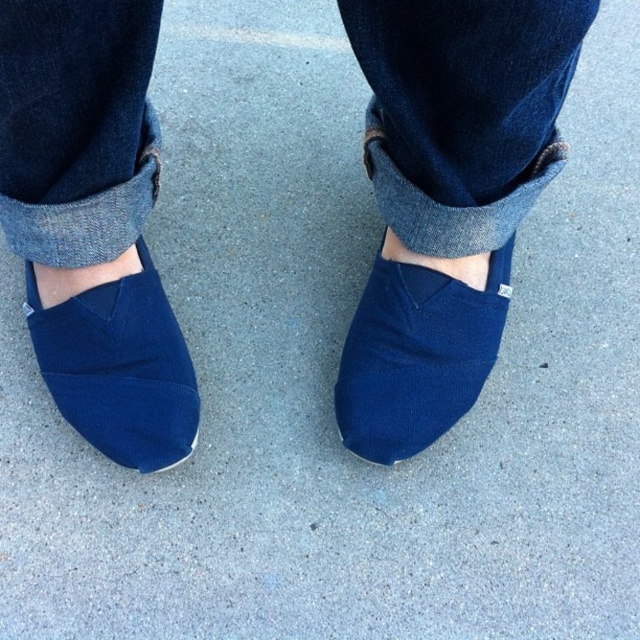
Which is above, navy blue canvas shoes at center or matte blue slip-on shoe at center?

navy blue canvas shoes at center is higher up.

Is navy blue canvas shoes at center wider than matte blue slip-on shoe at center?

Correct, the width of navy blue canvas shoes at center exceeds that of matte blue slip-on shoe at center.

This screenshot has height=640, width=640. What do you see at coordinates (445, 198) in the screenshot? I see `navy blue canvas shoes at center` at bounding box center [445, 198].

Where is `navy blue canvas shoes at center`? The image size is (640, 640). navy blue canvas shoes at center is located at coordinates (445, 198).

Can you confirm if navy blue canvas shoes at center is positioned below navy suede slip-on shoe at lower left?

No.

Find the location of a particular element. This screenshot has height=640, width=640. navy blue canvas shoes at center is located at coordinates (445, 198).

At what (x,y) coordinates should I click in order to perform the action: click on navy blue canvas shoes at center. Please return your answer as a coordinate pair (x, y). This screenshot has width=640, height=640. Looking at the image, I should click on (445, 198).

Is matte blue slip-on shoe at center closer to the viewer compared to navy suede slip-on shoe at lower left?

No, matte blue slip-on shoe at center is behind navy suede slip-on shoe at lower left.

Can you confirm if matte blue slip-on shoe at center is positioned below navy suede slip-on shoe at lower left?

Actually, matte blue slip-on shoe at center is above navy suede slip-on shoe at lower left.

Is point (468, 374) closer to camera compared to point (100, 429)?

No.

Where is `matte blue slip-on shoe at center`? The width and height of the screenshot is (640, 640). matte blue slip-on shoe at center is located at coordinates (417, 355).